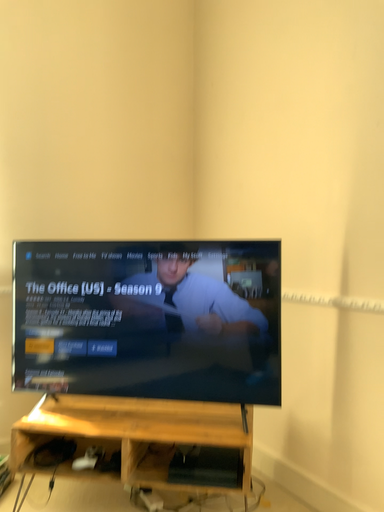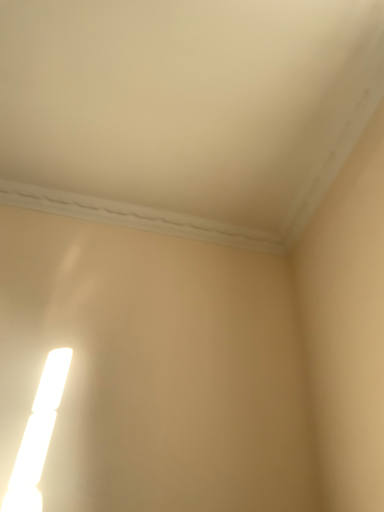
Question: Which way did the camera rotate in the video?

Choices:
 (A) rotated upward
 (B) rotated downward

Answer: (A)